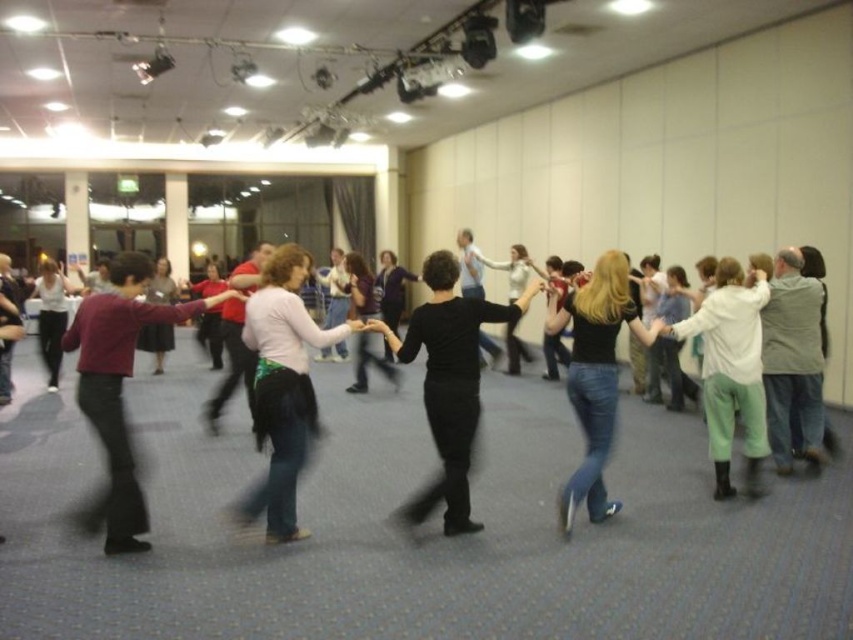
Who is shorter, black matte dress at center or jeans at center?

black matte dress at center

Does black matte dress at center appear under jeans at center?

Actually, black matte dress at center is above jeans at center.

Locate an element on the screen. This screenshot has width=853, height=640. black matte dress at center is located at coordinates (448, 384).

Between point (572, 301) and point (51, 378), which one is positioned in front?

Point (572, 301) is in front.

Who is lower down, jeans at center or matte white blouse at center?

jeans at center is below.

Identify the location of jeans at center. Image resolution: width=853 pixels, height=640 pixels. (595, 374).

Where is `jeans at center`? This screenshot has width=853, height=640. jeans at center is located at coordinates (595, 374).

Does white matte skirt at center have a smaller size compared to maroon sweater at left?

Yes.

Does white matte skirt at center have a lesser width compared to maroon sweater at left?

Indeed, white matte skirt at center has a lesser width compared to maroon sweater at left.

Locate an element on the screen. Image resolution: width=853 pixels, height=640 pixels. white matte skirt at center is located at coordinates (282, 388).